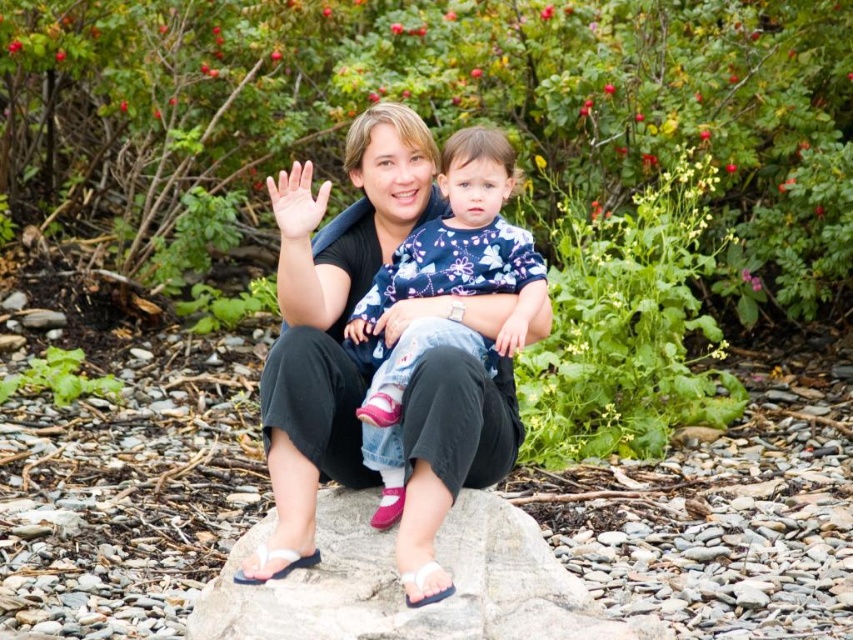
You are a photographer standing at the gray smooth rock at center and want to capture a photo of two people sitting on the rock. The adult is on the left and the child on the right. How far apart are the adult and the child?

The adult and the child are 9.65 meters apart.